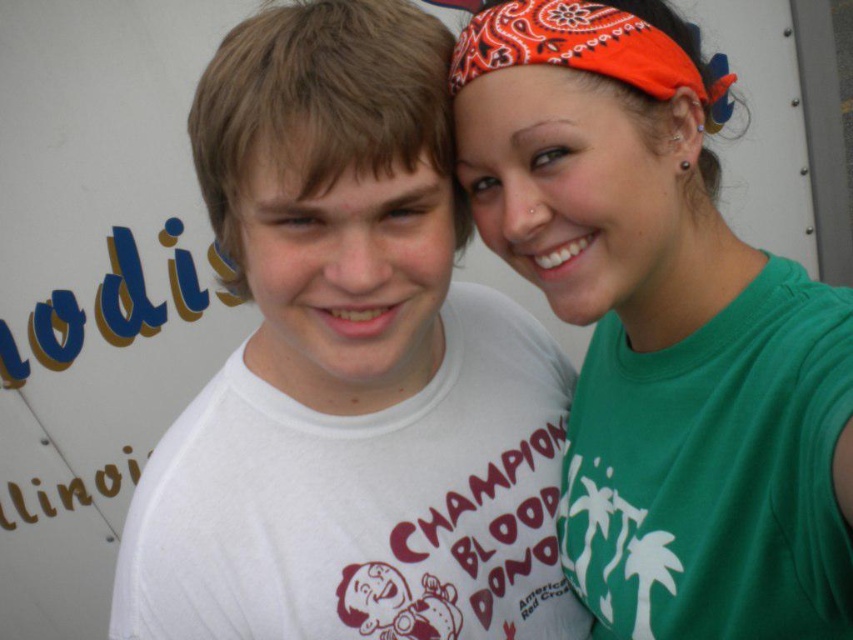
Question: Which object is the closest to the white matte t-shirt at center?

Choices:
 (A) green matte t-shirt at upper right
 (B) orange bandana at upper right

Answer: (A)

Question: Does white matte t-shirt at center lie in front of orange bandana at upper right?

Choices:
 (A) yes
 (B) no

Answer: (A)

Question: Does white matte t-shirt at center appear on the right side of orange bandana at upper right?

Choices:
 (A) yes
 (B) no

Answer: (B)

Question: Which point appears farthest from the camera in this image?

Choices:
 (A) (612, 48)
 (B) (248, 362)

Answer: (B)

Question: Which of the following is the farthest from the observer?

Choices:
 (A) orange bandana at upper right
 (B) green matte t-shirt at upper right

Answer: (A)

Question: Is green matte t-shirt at upper right thinner than orange bandana at upper right?

Choices:
 (A) no
 (B) yes

Answer: (A)